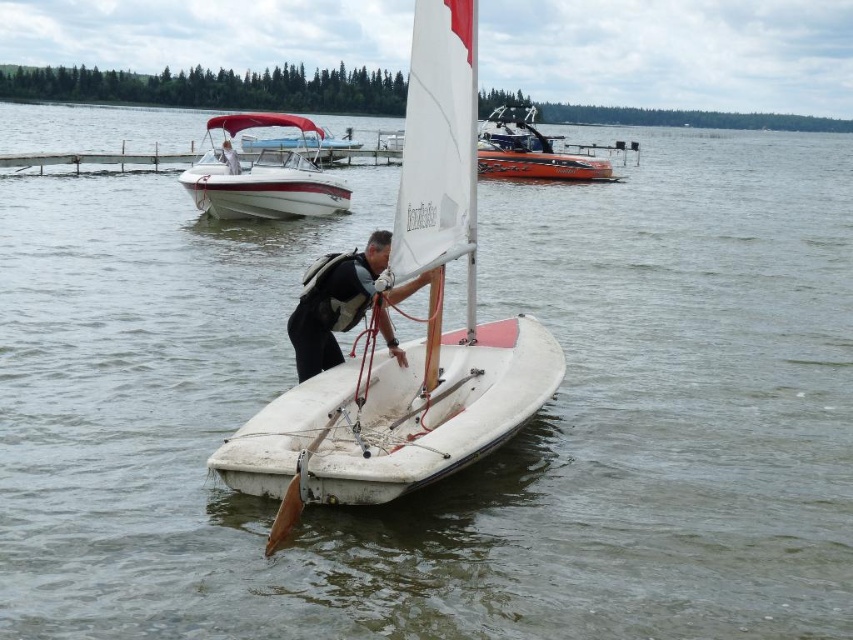
Question: Is white matte sailboat at center below black fabric vest at center?

Choices:
 (A) yes
 (B) no

Answer: (B)

Question: Where is white matte sailboat at center located in relation to white glossy boat at upper left in the image?

Choices:
 (A) left
 (B) right

Answer: (B)

Question: Which object appears closest to the camera in this image?

Choices:
 (A) black fabric person at center
 (B) white glossy boat at upper left

Answer: (B)

Question: Is white matte sailboat at center closer to camera compared to orange fiberglass boat at upper center?

Choices:
 (A) yes
 (B) no

Answer: (A)

Question: Which is farther from the black fabric vest at center?

Choices:
 (A) white glossy boat at upper left
 (B) black fabric person at center
 (C) white matte sailboat at center

Answer: (A)

Question: Based on their relative distances, which object is nearer to the white matte sailboat at center?

Choices:
 (A) black fabric person at center
 (B) orange fiberglass boat at upper center
 (C) white glossy boat at upper left

Answer: (B)